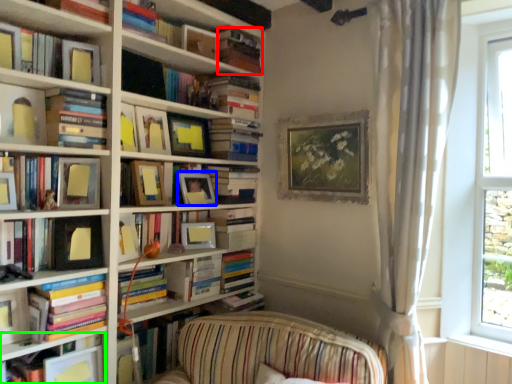
Question: Which object is positioned farthest from book (highlighted by a red box)? Select from picture frame (highlighted by a blue box) and book (highlighted by a green box).

Choices:
 (A) picture frame
 (B) book

Answer: (B)